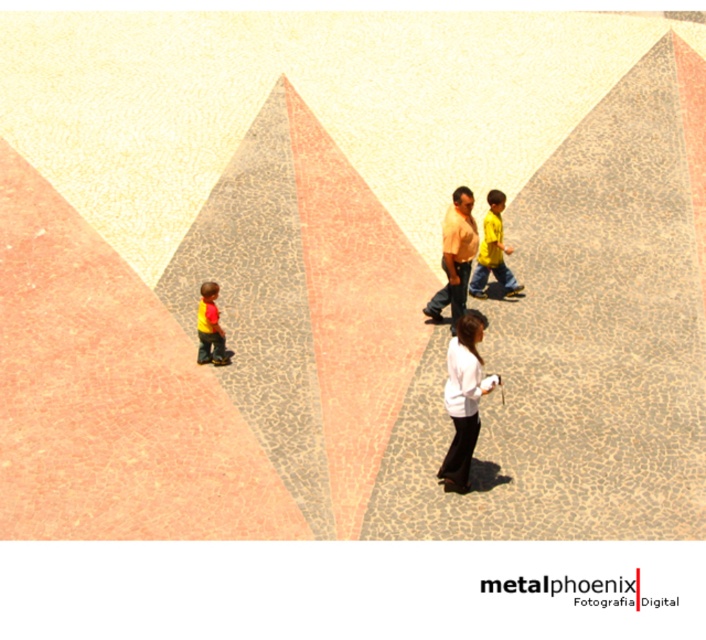
You are a photographer trying to capture a group photo of the two adults and two children in the scene. You want to ensure that both the white matte shirt at center and the matte pink shirt at center are clearly visible in the photo. Given their heights, which shirt should you focus on to ensure proper exposure?

The white matte shirt at center has a greater height compared to the matte pink shirt at center, so focusing on the white matte shirt at center would ensure proper exposure as it is taller and more prominent in the frame.

You are standing at the point labeled point (469, 442) and want to walk to point (220, 333). Given that both points are on the ground, which direction should you move to get closer to your destination?

You should move away from the camera because point (469, 442) is closer to the camera than point (220, 333). Moving away from the camera will take you towards the destination.